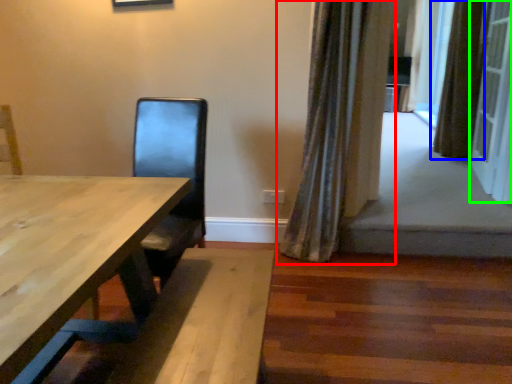
Question: Which object is the farthest from curtain (highlighted by a red box)? Choose among these: curtain (highlighted by a blue box) or screen door (highlighted by a green box).

Choices:
 (A) curtain
 (B) screen door

Answer: (A)